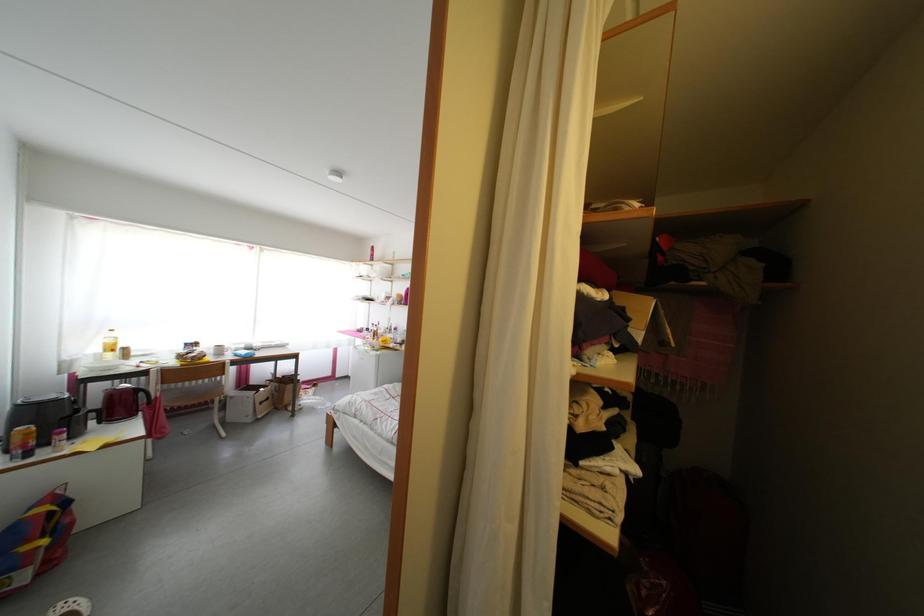
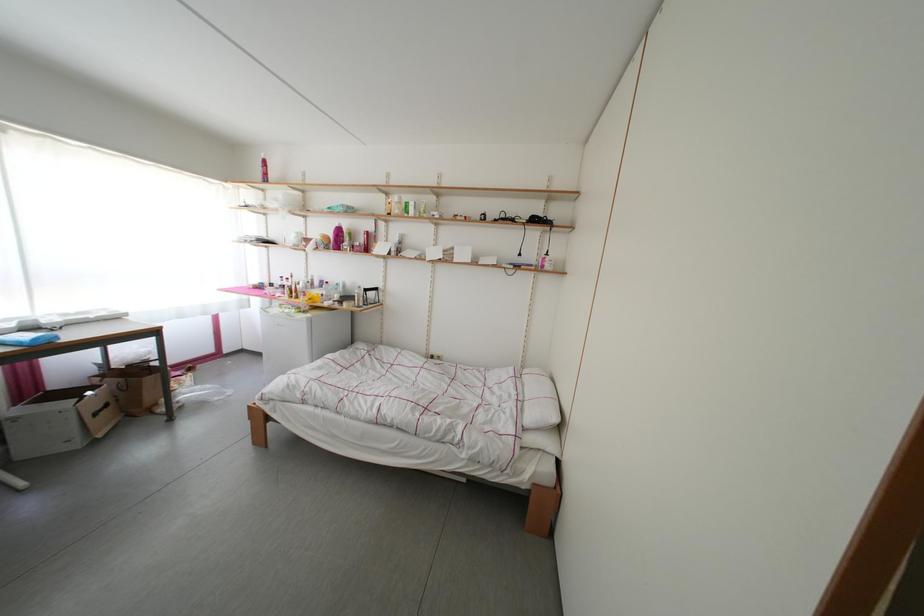
In the scene shown: The images are taken continuously from a first-person perspective. In which direction are you moving?

The cameraman moved toward left, forward.